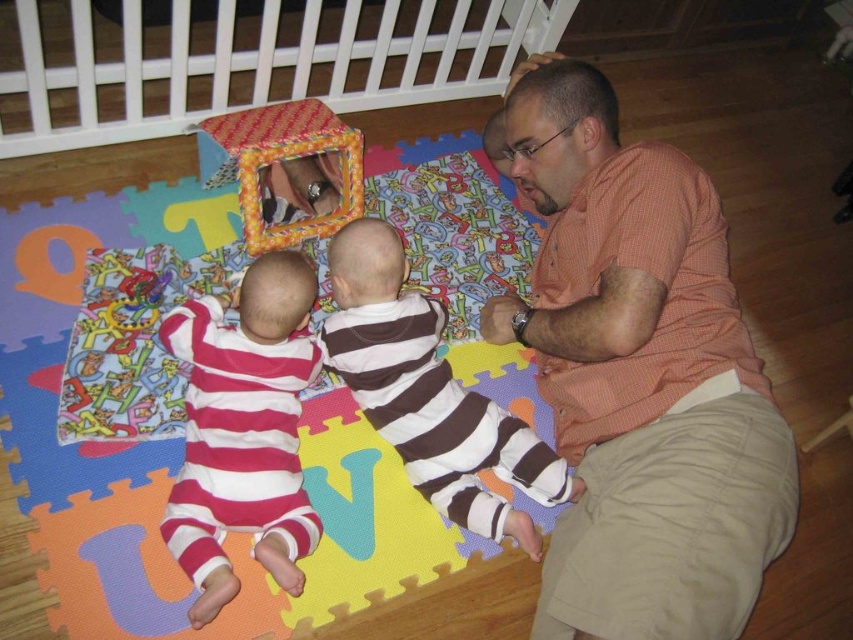
You are a parent looking for a toy for your baby. You see an orange checkered shirt at upper right and a plaid fabric cube at upper center. Which one is located to the right of the other?

The orange checkered shirt at upper right is positioned on the right side of the plaid fabric cube at upper center.

You are a parent trying to choose between two outfits for your baby. You see the pink striped onesie at lower left and the brown striped shirt at center in the image. Which one is shorter in length?

The pink striped onesie at lower left is shorter in length compared to the brown striped shirt at center.